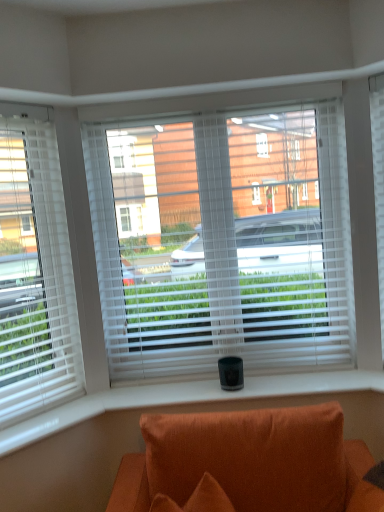
Question: Could you tell me if orange fabric couch at lower center is turned towards white blinds at center, which is counted as the second window, starting from the left?

Choices:
 (A) yes
 (B) no

Answer: (B)

Question: Is orange fabric couch at lower center oriented away from white blinds at center, which is counted as the second window, starting from the left?

Choices:
 (A) no
 (B) yes

Answer: (A)

Question: Is orange fabric couch at lower center at the right side of white blinds at center, which is counted as the second window, starting from the left?

Choices:
 (A) no
 (B) yes

Answer: (B)

Question: Can you confirm if orange fabric couch at lower center is taller than white blinds at center, the 1th window viewed from the right?

Choices:
 (A) no
 (B) yes

Answer: (A)

Question: Is orange fabric couch at lower center bigger than white blinds at center, the 1th window viewed from the right?

Choices:
 (A) yes
 (B) no

Answer: (A)

Question: Is orange fabric couch at lower center far from white blinds at center, which is counted as the second window, starting from the left?

Choices:
 (A) no
 (B) yes

Answer: (A)

Question: Is white blinds at left, which ranks as the first window in left-to-right order, taller than orange fabric couch at lower center?

Choices:
 (A) no
 (B) yes

Answer: (B)

Question: Does white blinds at left, which ranks as the first window in left-to-right order, appear on the right side of orange fabric couch at lower center?

Choices:
 (A) yes
 (B) no

Answer: (B)

Question: Is white blinds at left, the second window viewed from the right, behind orange fabric couch at lower center?

Choices:
 (A) no
 (B) yes

Answer: (B)

Question: Can you confirm if white blinds at left, which ranks as the first window in left-to-right order, is bigger than orange fabric couch at lower center?

Choices:
 (A) yes
 (B) no

Answer: (B)

Question: Is the depth of white blinds at left, the second window viewed from the right, less than that of orange fabric couch at lower center?

Choices:
 (A) yes
 (B) no

Answer: (B)

Question: Does white blinds at left, which ranks as the first window in left-to-right order, appear on the left side of orange fabric couch at lower center?

Choices:
 (A) no
 (B) yes

Answer: (B)

Question: Is white blinds at center, which is counted as the second window, starting from the left, not close to white blinds at left, which ranks as the first window in left-to-right order?

Choices:
 (A) yes
 (B) no

Answer: (B)